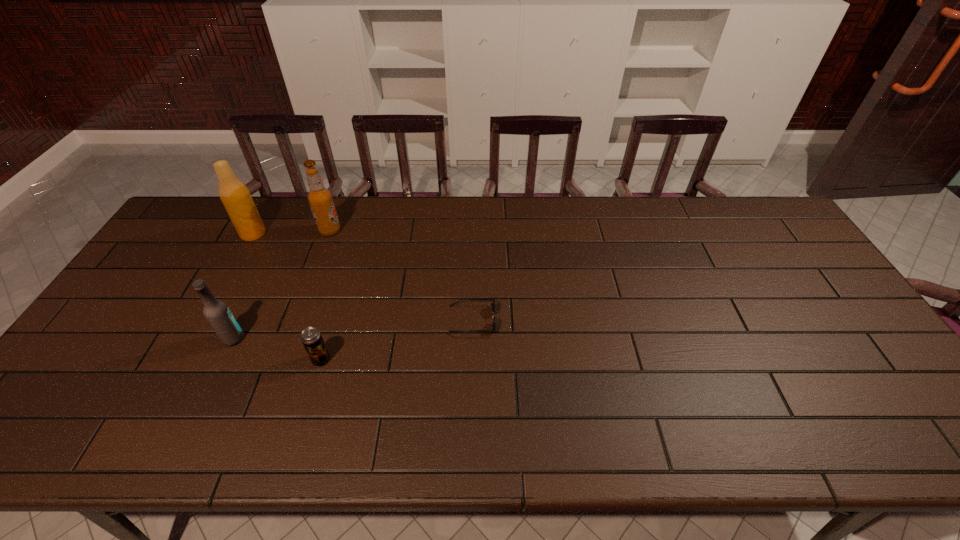
Locate which beer bottle is the closest to the fourth object from left to right. Please provide its 2D coordinates. Your answer should be formatted as a tuple, i.e. [(x, y)], where the tuple contains the x and y coordinates of a point satisfying the conditions above.

[(217, 313)]

Find the location of a particular element. Image resolution: width=960 pixels, height=540 pixels. beer bottle identified as the second closest to the third object from left to right is located at coordinates (x=217, y=313).

What are the coordinates of `free space that satisfies the following two spatial constraints: 1. on the side of the nearest object with the label; 2. on the left side of the second object from left to right` in the screenshot? It's located at (224, 360).